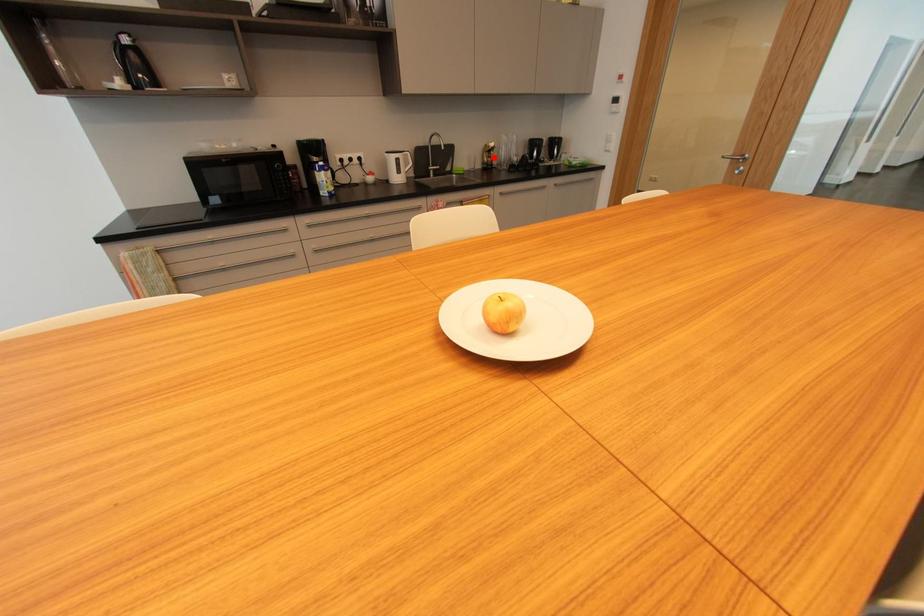
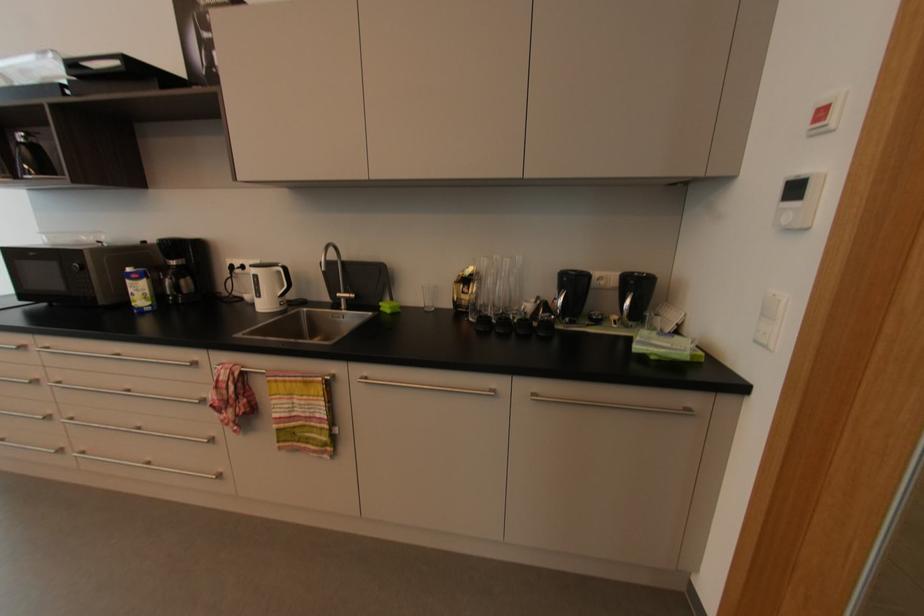
Question: I am providing you with two images of the same scene from different viewpoints. A red point is shown in image1. For the corresponding object point in image2, is it positioned nearer or farther from the camera?

Choices:
 (A) Nearer
 (B) Farther

Answer: (B)